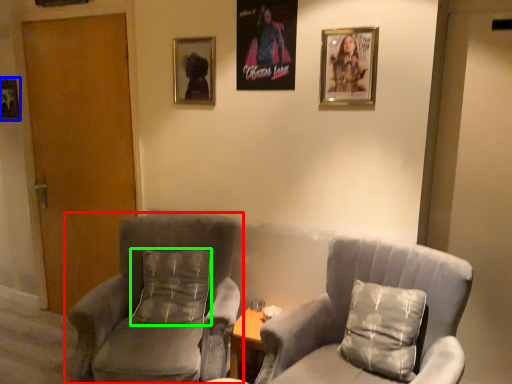
Question: Based on their relative distances, which object is farther from chair (highlighted by a red box)? Choose from picture frame (highlighted by a blue box) and pillow (highlighted by a green box).

Choices:
 (A) picture frame
 (B) pillow

Answer: (A)